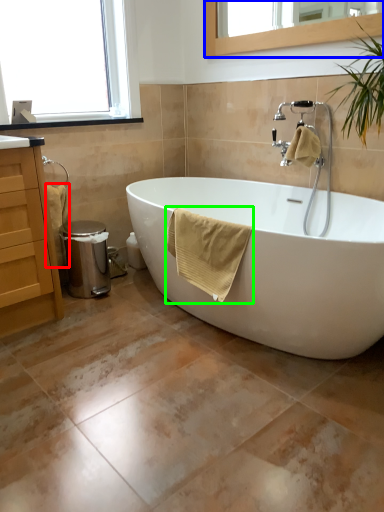
Question: Which object is positioned farthest from material (highlighted by a red box)? Select from mirror (highlighted by a blue box) and bath towel (highlighted by a green box).

Choices:
 (A) mirror
 (B) bath towel

Answer: (A)